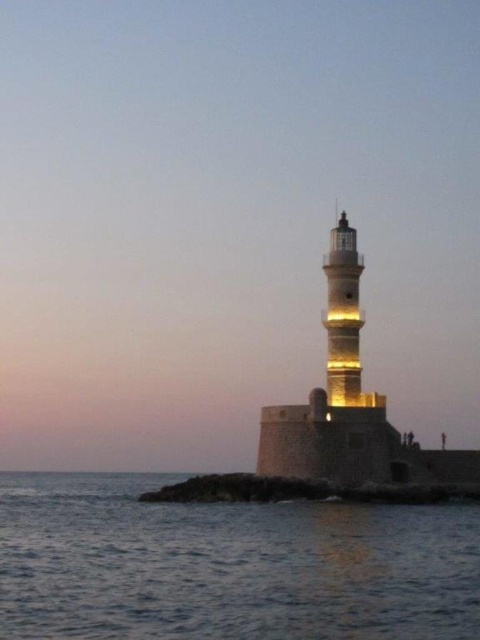
Is the position of blue water at lower left less distant than that of rusty stone shoreline at lower center?

Yes, it is in front of rusty stone shoreline at lower center.

Does point (115, 516) lie in front of point (237, 476)?

Yes, point (115, 516) is in front of point (237, 476).

Does point (116, 582) come closer to viewer compared to point (410, 483)?

Yes, it is in front of point (410, 483).

At what (x,y) coordinates should I click in order to perform the action: click on blue water at lower left. Please return your answer as a coordinate pair (x, y). This screenshot has width=480, height=640. Looking at the image, I should click on (228, 564).

Is blue water at lower left below light brown stone lighthouse at center?

Yes.

What are the coordinates of `blue water at lower left` in the screenshot? It's located at (228, 564).

Is blue water at lower left thinner than yellowish stone tower at center?

Incorrect, blue water at lower left's width is not less than yellowish stone tower at center's.

Can you confirm if blue water at lower left is positioned below yellowish stone tower at center?

Yes.

Describe the element at coordinates (228, 564) in the screenshot. This screenshot has width=480, height=640. I see `blue water at lower left` at that location.

Where is `blue water at lower left`? The height and width of the screenshot is (640, 480). blue water at lower left is located at coordinates (228, 564).